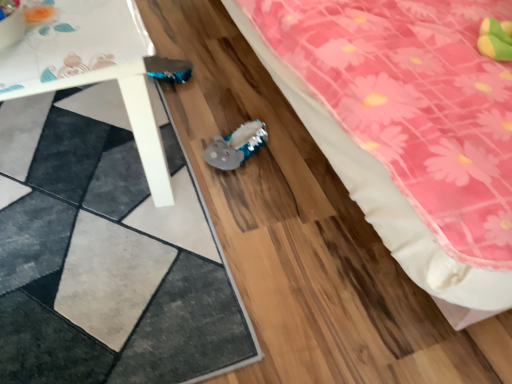
Where is `free space that is in between white plastic table at lower left and fuzzy fabric plushie at center`? The image size is (512, 384). free space that is in between white plastic table at lower left and fuzzy fabric plushie at center is located at coordinates (197, 125).